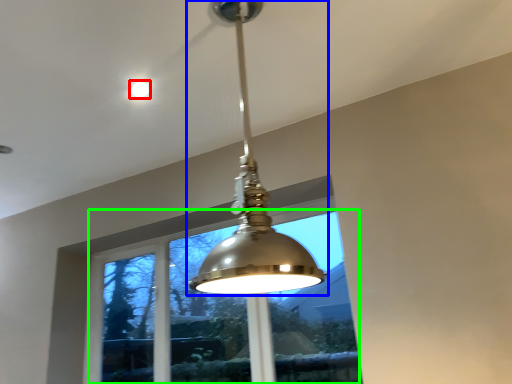
Question: Estimate the real-world distances between objects in this image. Which object is farther from droplight (highlighted by a red box), lamp (highlighted by a blue box) or window (highlighted by a green box)?

Choices:
 (A) lamp
 (B) window

Answer: (B)